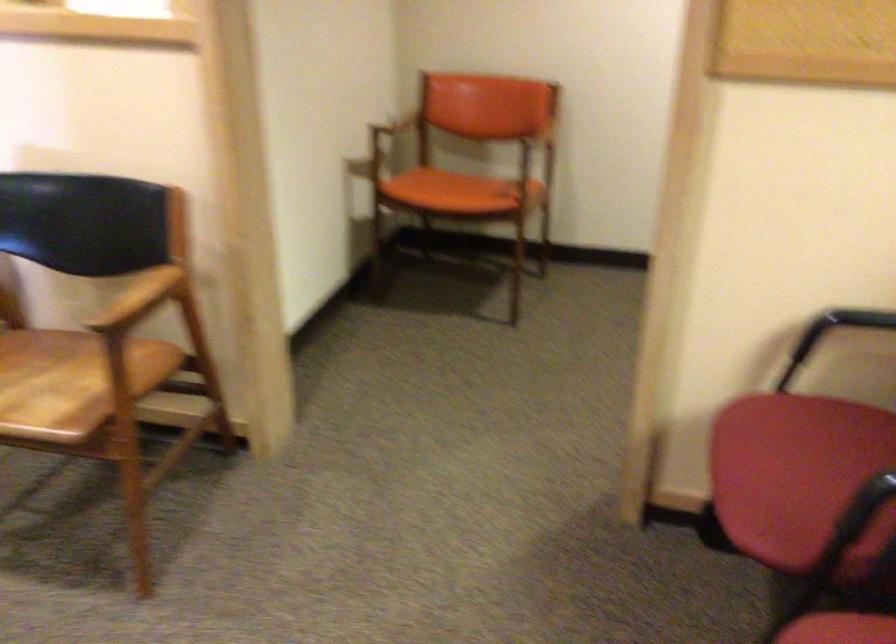
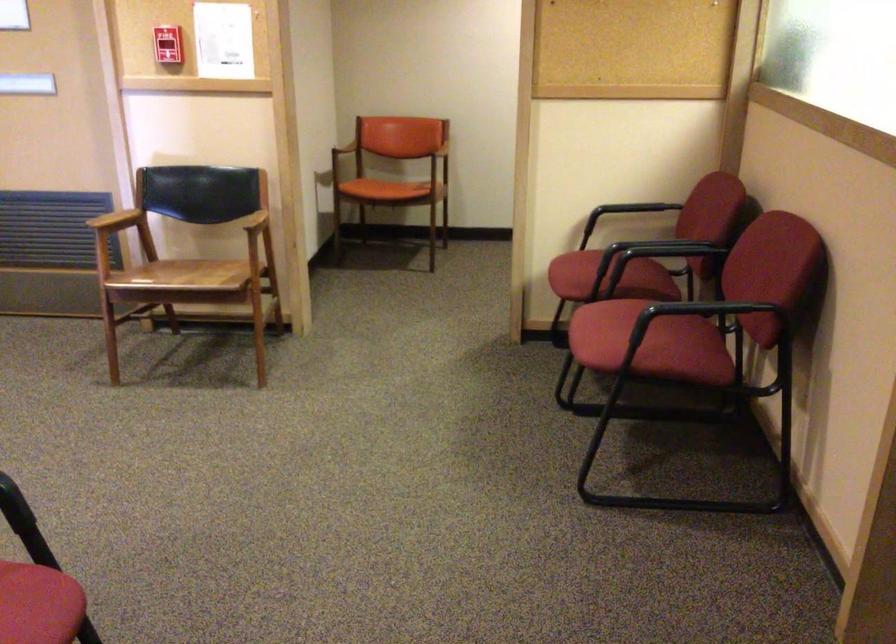
Find the pixel in the second image that matches (393,129) in the first image.

(345, 147)